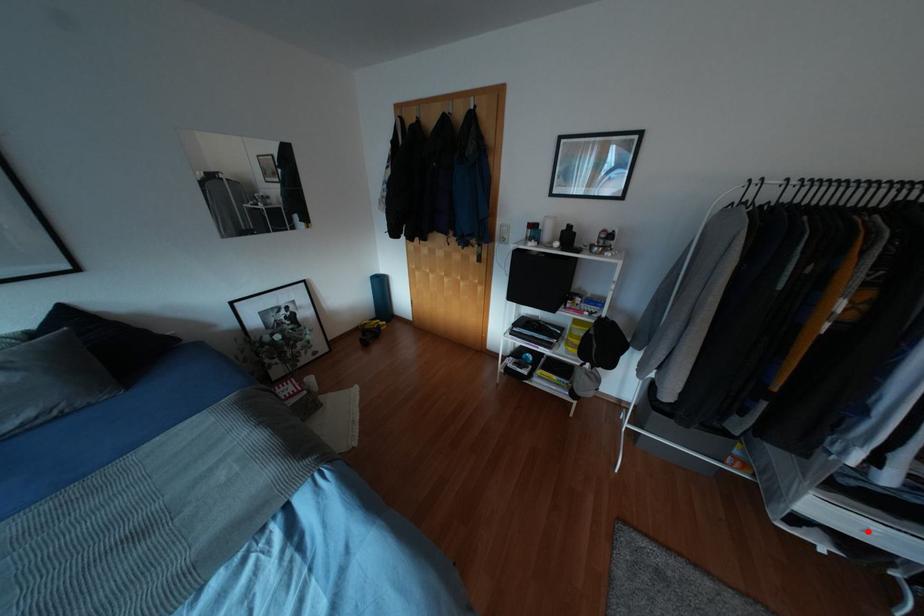
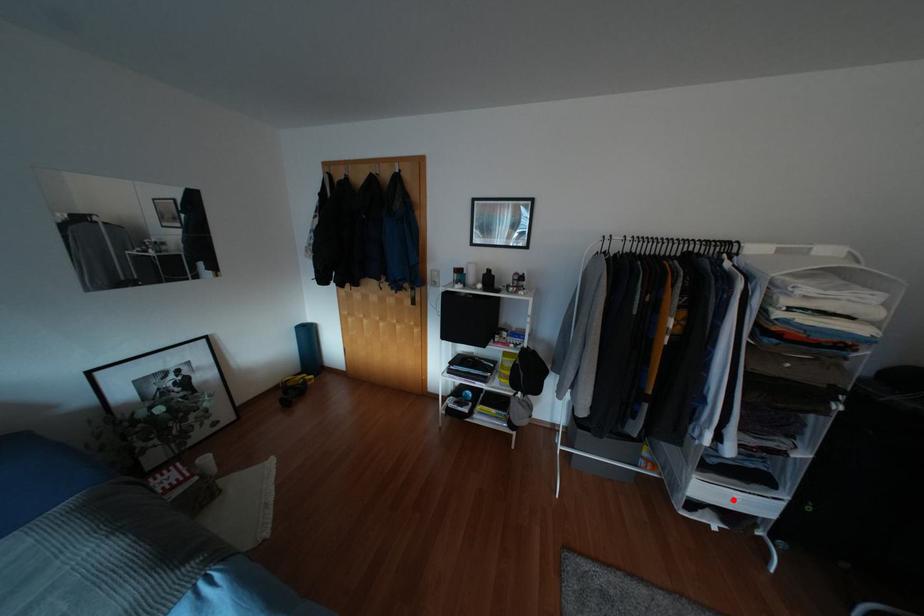
In the scene shown: I am providing you with two images of the same scene from different viewpoints. A red point is marked on the first image and another point is marked on the second image. Are the points marked in image1 and image2 representing the same 3D position?

Yes